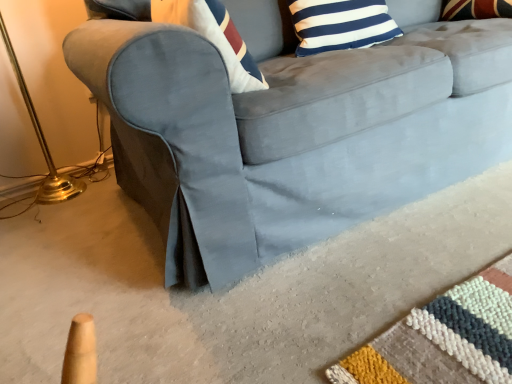
Question: Is the surface of blue and white striped pillow at upper center in direct contact with gold metallic table lamp at left?

Choices:
 (A) no
 (B) yes

Answer: (A)

Question: From the image's perspective, is blue and white striped pillow at upper center under gold metallic table lamp at left?

Choices:
 (A) yes
 (B) no

Answer: (B)

Question: Considering the relative sizes of blue and white striped pillow at upper center and gold metallic table lamp at left in the image provided, is blue and white striped pillow at upper center wider than gold metallic table lamp at left?

Choices:
 (A) yes
 (B) no

Answer: (B)

Question: Is blue and white striped pillow at upper center in front of gold metallic table lamp at left?

Choices:
 (A) no
 (B) yes

Answer: (A)

Question: From a real-world perspective, is blue and white striped pillow at upper center below gold metallic table lamp at left?

Choices:
 (A) no
 (B) yes

Answer: (A)

Question: Considering the relative sizes of blue and white striped pillow at upper center and gold metallic table lamp at left in the image provided, is blue and white striped pillow at upper center taller than gold metallic table lamp at left?

Choices:
 (A) yes
 (B) no

Answer: (B)

Question: Is suede gray couch at center at the left side of blue and white striped pillow at upper center?

Choices:
 (A) no
 (B) yes

Answer: (A)

Question: Is suede gray couch at center smaller than blue and white striped pillow at upper center?

Choices:
 (A) yes
 (B) no

Answer: (B)

Question: Can you confirm if suede gray couch at center is shorter than blue and white striped pillow at upper center?

Choices:
 (A) no
 (B) yes

Answer: (A)

Question: Considering the relative positions of suede gray couch at center and blue and white striped pillow at upper center in the image provided, is suede gray couch at center behind blue and white striped pillow at upper center?

Choices:
 (A) yes
 (B) no

Answer: (B)

Question: From a real-world perspective, is suede gray couch at center located higher than blue and white striped pillow at upper center?

Choices:
 (A) yes
 (B) no

Answer: (B)

Question: Is blue and white striped pillow at upper center a part of suede gray couch at center?

Choices:
 (A) yes
 (B) no

Answer: (A)

Question: Is blue and white striped pillow at upper center wider than suede gray couch at center?

Choices:
 (A) yes
 (B) no

Answer: (B)